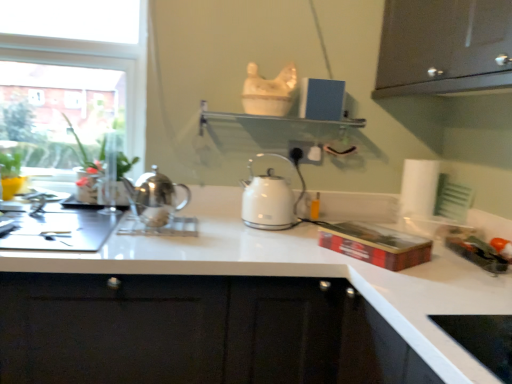
Find the location of a particular element. The image size is (512, 384). free point in front of polished silver kettle at center, the 1th kettle viewed from the front is located at coordinates (144, 238).